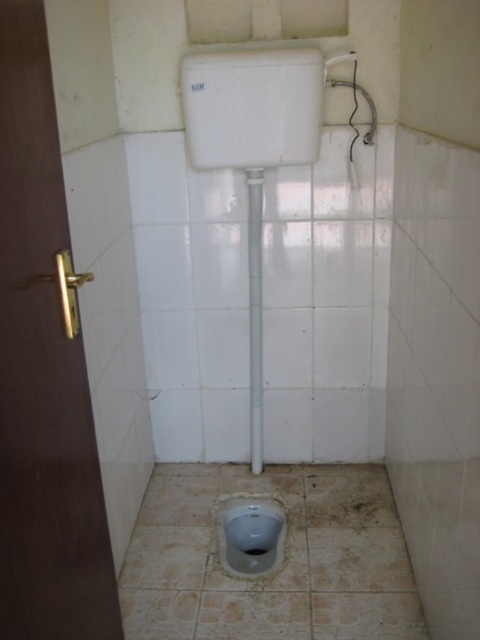
Question: Is matte gray toilet bowl at lower center positioned behind gray matte urinal at center?

Choices:
 (A) yes
 (B) no

Answer: (B)

Question: Can you confirm if matte gray toilet bowl at lower center is positioned to the right of gray matte urinal at center?

Choices:
 (A) yes
 (B) no

Answer: (B)

Question: Which of the following is the closest to the observer?

Choices:
 (A) gray matte urinal at center
 (B) matte gray toilet bowl at lower center

Answer: (B)

Question: Which object is farther from the camera taking this photo?

Choices:
 (A) matte gray toilet bowl at lower center
 (B) gray matte urinal at center

Answer: (B)

Question: Is the position of matte gray toilet bowl at lower center less distant than that of gray matte urinal at center?

Choices:
 (A) yes
 (B) no

Answer: (A)

Question: Which point appears closest to the camera in this image?

Choices:
 (A) click(241, 513)
 (B) click(251, 548)

Answer: (B)